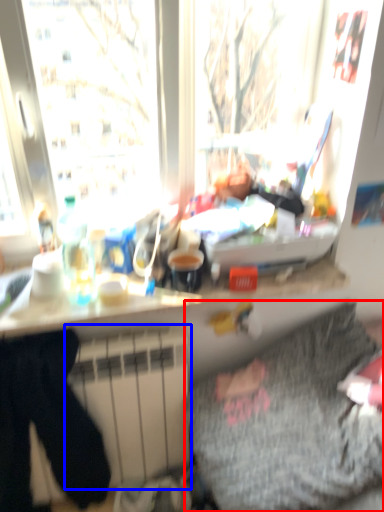
Question: Among these objects, which one is nearest to the camera, bedding (highlighted by a red box) or radiator (highlighted by a blue box)?

Choices:
 (A) bedding
 (B) radiator

Answer: (A)